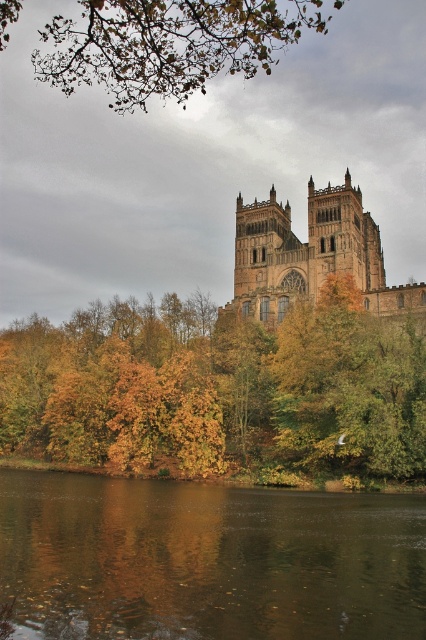
Question: Observing the image, what is the correct spatial positioning of brown reflective water at lower center in reference to green leafy branches at upper center?

Choices:
 (A) left
 (B) right

Answer: (A)

Question: Which object is positioned closest to the brown stone church at upper center?

Choices:
 (A) green leafy branches at upper center
 (B) brown reflective water at lower center

Answer: (A)

Question: Which point is closer to the camera taking this photo?

Choices:
 (A) (135, 93)
 (B) (111, 611)
 (C) (313, 253)
 (D) (91, 376)

Answer: (B)

Question: Does autumn leaves at center come behind brown stone church at upper center?

Choices:
 (A) yes
 (B) no

Answer: (B)

Question: Among these points, which one is farthest from the camera?

Choices:
 (A) (370, 284)
 (B) (89, 64)
 (C) (218, 422)
 (D) (114, 579)

Answer: (B)

Question: Can you confirm if brown reflective water at lower center is positioned to the left of brown stone church at upper center?

Choices:
 (A) no
 (B) yes

Answer: (B)